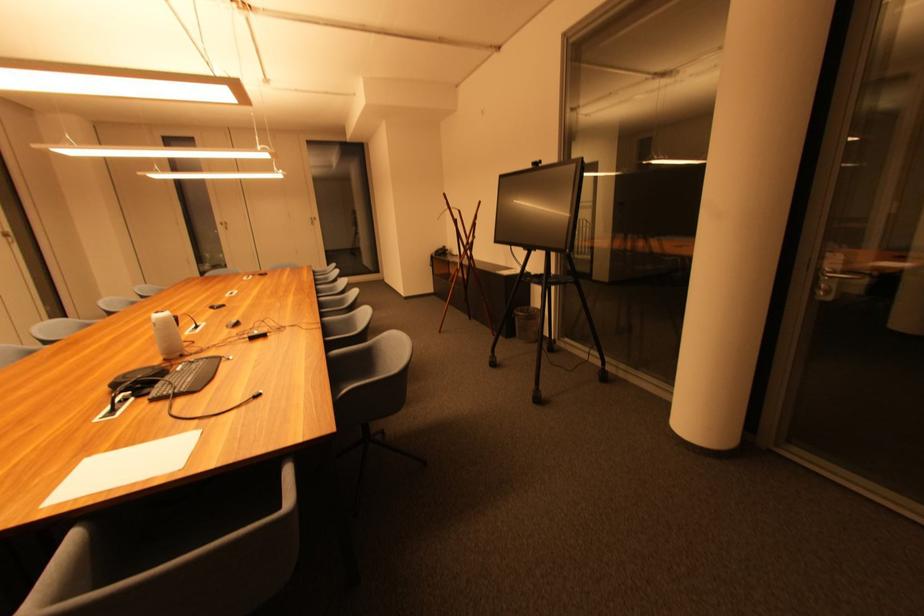
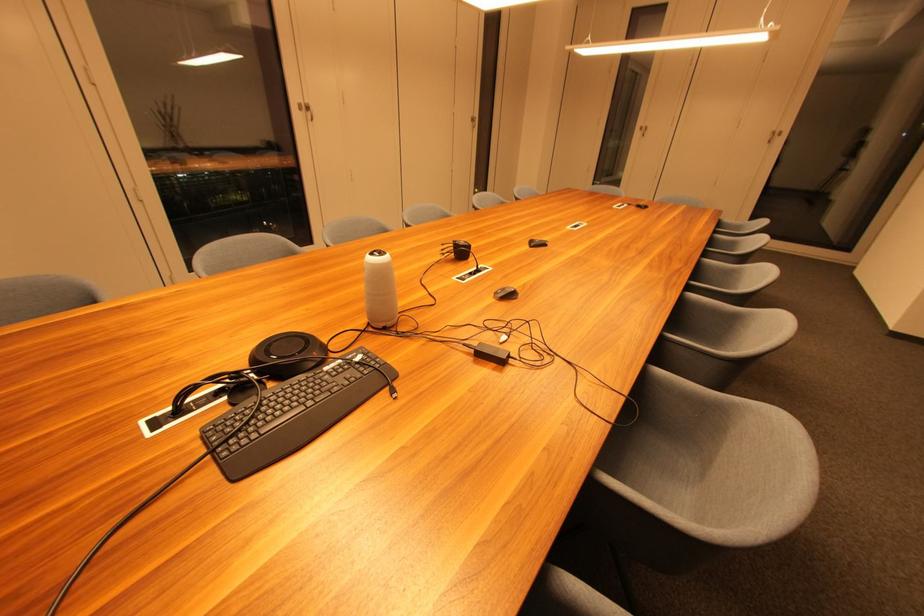
Locate, in the second image, the point that corresponds to (x=184, y=371) in the first image.

(332, 371)